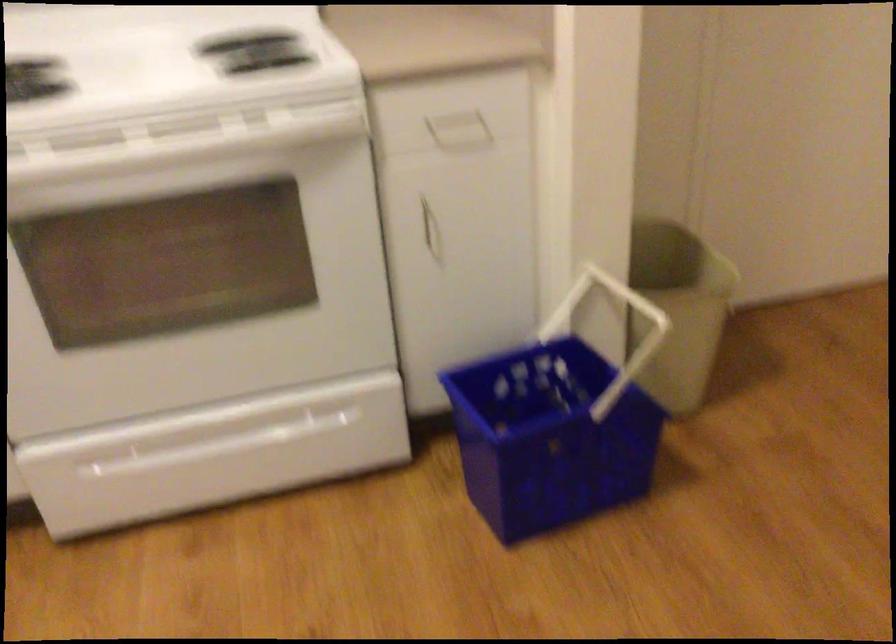
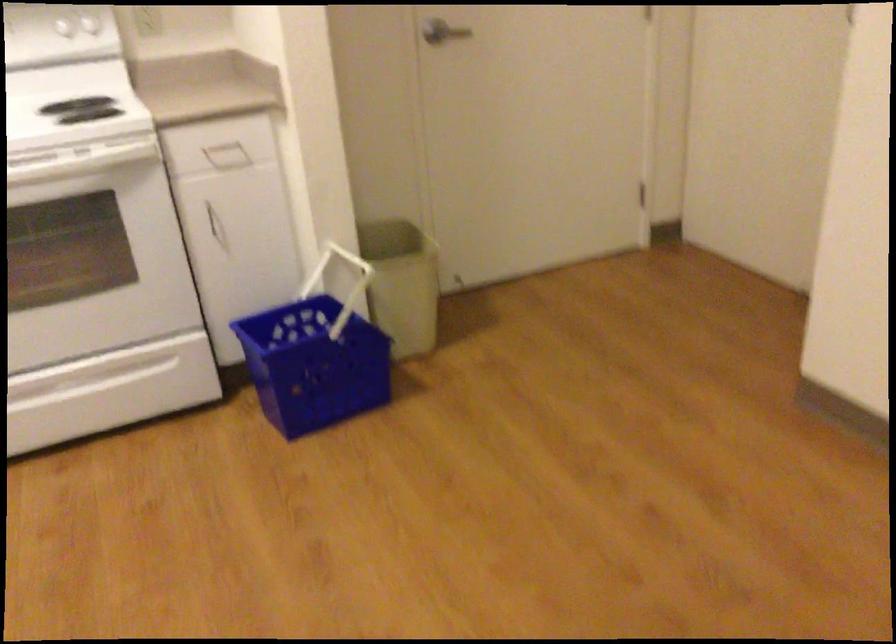
In the second image, find the point that corresponds to the point at 676,328 in the first image.

(401, 283)